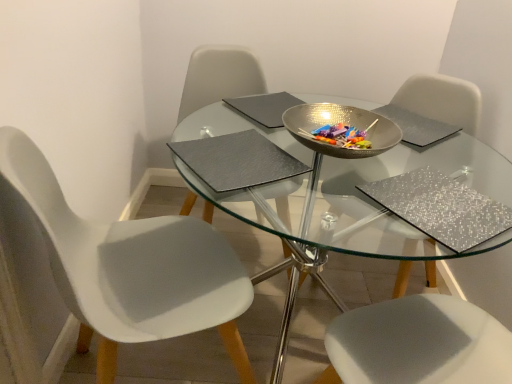
Where is `silver glittery chair at upper right, which is the first chair in right-to-left order`? The height and width of the screenshot is (384, 512). silver glittery chair at upper right, which is the first chair in right-to-left order is located at coordinates (441, 100).

Identify the location of matte gray pad at center, the 2th pad from the right. This screenshot has width=512, height=384. (265, 107).

Is silver glittery placemat at lower right, arranged as the second place mat when viewed from the left, positioned beyond the bounds of silver glittery chair at upper right, arranged as the 3th chair when viewed from the left?

silver glittery placemat at lower right, arranged as the second place mat when viewed from the left, is positioned outside silver glittery chair at upper right, arranged as the 3th chair when viewed from the left.

Considering the relative sizes of silver glittery placemat at lower right, positioned as the first place mat in right-to-left order, and silver glittery chair at upper right, which is the first chair in right-to-left order, in the image provided, is silver glittery placemat at lower right, positioned as the first place mat in right-to-left order, shorter than silver glittery chair at upper right, which is the first chair in right-to-left order,?

Yes, silver glittery placemat at lower right, positioned as the first place mat in right-to-left order, is shorter than silver glittery chair at upper right, which is the first chair in right-to-left order.

From the image's perspective, who appears lower, silver glittery placemat at lower right, positioned as the first place mat in right-to-left order, or silver glittery chair at upper right, which is the first chair in right-to-left order?

silver glittery placemat at lower right, positioned as the first place mat in right-to-left order, is shown below in the image.

From a real-world perspective, relative to silver glittery chair at upper right, arranged as the 3th chair when viewed from the left, is silver glittery placemat at lower right, positioned as the first place mat in right-to-left order, vertically above or below?

Clearly, from a real-world perspective, silver glittery placemat at lower right, positioned as the first place mat in right-to-left order, is above silver glittery chair at upper right, arranged as the 3th chair when viewed from the left.

Can you tell me how much white matte chair at left, which appears as the 1th chair when viewed from the left, and matte gray pad at center, which ranks as the 1th pad in left-to-right order, differ in facing direction?

They differ by 103 degrees in their facing directions.

Could you measure the distance between white matte chair at left, the 3th chair viewed from the right, and matte gray pad at center, which ranks as the 1th pad in left-to-right order?

They are 56.45 centimeters apart.

Does white matte chair at left, which appears as the 1th chair when viewed from the left, turn towards matte gray pad at center, the 2th pad from the right?

No, white matte chair at left, which appears as the 1th chair when viewed from the left, is not oriented towards matte gray pad at center, the 2th pad from the right.

Which of these two, white matte chair at left, which appears as the 1th chair when viewed from the left, or matte gray pad at center, the 2th pad from the right, is bigger?

white matte chair at left, which appears as the 1th chair when viewed from the left, is bigger.

Is point (388, 105) farther from viewer compared to point (453, 110)?

Yes, it is.

Is silver textured pad at upper center, which is the 2th pad in left-to-right order, facing towards silver glittery chair at upper right, which is the first chair in right-to-left order?

Yes, silver textured pad at upper center, which is the 2th pad in left-to-right order, is facing silver glittery chair at upper right, which is the first chair in right-to-left order.

Can you confirm if silver textured pad at upper center, which is the 2th pad in left-to-right order, is shorter than silver glittery chair at upper right, arranged as the 3th chair when viewed from the left?

Indeed, silver textured pad at upper center, which is the 2th pad in left-to-right order, has a lesser height compared to silver glittery chair at upper right, arranged as the 3th chair when viewed from the left.

Can you tell me how much silver textured pad at upper center, arranged as the first pad when viewed from the right, and silver glittery chair at upper right, which is the first chair in right-to-left order, differ in facing direction?

They differ by 176 degrees in their facing directions.

From the image's perspective, does silver textured pad at upper center, arranged as the first pad when viewed from the right, appear lower than matte gray place mat at center, the 1th place mat viewed from the left?

No.

Would you consider silver textured pad at upper center, which is the 2th pad in left-to-right order, to be distant from matte gray place mat at center, the 1th place mat viewed from the left?

No.

In order to click on the 2nd pad counting from the right of the matte gray place mat at center, which is counted as the 2th place mat, starting from the right in this screenshot , I will do `click(417, 126)`.

Looking at this image, which object is wider, silver textured pad at upper center, arranged as the first pad when viewed from the right, or matte gray place mat at center, which is counted as the 2th place mat, starting from the right?

matte gray place mat at center, which is counted as the 2th place mat, starting from the right.

The width and height of the screenshot is (512, 384). What are the coordinates of `chair that appears in front of the silver glittery placemat at lower right, arranged as the second place mat when viewed from the left` in the screenshot? It's located at point(132,268).

From the image's perspective, is white matte chair at left, the 3th chair viewed from the right, under silver glittery placemat at lower right, positioned as the first place mat in right-to-left order?

Yes, from the image's perspective, white matte chair at left, the 3th chair viewed from the right, is below silver glittery placemat at lower right, positioned as the first place mat in right-to-left order.

Is white matte chair at left, the 3th chair viewed from the right, situated inside silver glittery placemat at lower right, positioned as the first place mat in right-to-left order, or outside?

The correct answer is: outside.

Is white matte chair at left, which appears as the 1th chair when viewed from the left, facing away from silver glittery placemat at lower right, arranged as the second place mat when viewed from the left?

That's not correct — white matte chair at left, which appears as the 1th chair when viewed from the left, is not looking away from silver glittery placemat at lower right, arranged as the second place mat when viewed from the left.

Which of these two, matte gray place mat at center, the 1th place mat viewed from the left, or white matte chair at left, the 3th chair viewed from the right, stands taller?

Standing taller between the two is white matte chair at left, the 3th chair viewed from the right.

Between matte gray place mat at center, the 1th place mat viewed from the left, and white matte chair at left, the 3th chair viewed from the right, which one has smaller size?

matte gray place mat at center, the 1th place mat viewed from the left.

Is matte gray place mat at center, which is counted as the 2th place mat, starting from the right, next to white matte chair at left, which appears as the 1th chair when viewed from the left, and touching it?

No, matte gray place mat at center, which is counted as the 2th place mat, starting from the right, is not in contact with white matte chair at left, which appears as the 1th chair when viewed from the left.

Which object is more forward, shiny metallic bowl at center or matte gray place mat at center, which is counted as the 2th place mat, starting from the right?

matte gray place mat at center, which is counted as the 2th place mat, starting from the right, is in front.

From the image's perspective, is shiny metallic bowl at center above or below matte gray place mat at center, the 1th place mat viewed from the left?

From the image's perspective, shiny metallic bowl at center appears above matte gray place mat at center, the 1th place mat viewed from the left.

Is matte gray place mat at center, which is counted as the 2th place mat, starting from the right, at the back of shiny metallic bowl at center?

No, matte gray place mat at center, which is counted as the 2th place mat, starting from the right, is not at the back of shiny metallic bowl at center.

You are a GUI agent. You are given a task and a screenshot of the screen. Output one action in this format:
    pyautogui.click(x=<x>, y=<y>)
    Task: Click on the place mat that is the 1st object located below the shiny metallic bowl at center (from the image's perspective)
    The width and height of the screenshot is (512, 384).
    Given the screenshot: What is the action you would take?
    pyautogui.click(x=238, y=161)

The width and height of the screenshot is (512, 384). Find the location of `place mat that is below the silver glittery chair at upper right, which is the first chair in right-to-left order (from the image's perspective)`. place mat that is below the silver glittery chair at upper right, which is the first chair in right-to-left order (from the image's perspective) is located at coordinates (441, 207).

From the matte gray pad at center, which ranks as the 1th pad in left-to-right order, count the 2nd chair to the left and point to it. Please provide its 2D coordinates.

[(132, 268)]

Which object lies further to the anchor point matte gray pad at center, the 2th pad from the right, clear glass table at center or silver glittery chair at upper right, arranged as the 3th chair when viewed from the left?

silver glittery chair at upper right, arranged as the 3th chair when viewed from the left, is further to matte gray pad at center, the 2th pad from the right.

Based on their spatial positions, is matte gray pad at center, which ranks as the 1th pad in left-to-right order, or matte gray place mat at center, which is counted as the 2th place mat, starting from the right, further from silver glittery chair at upper right, which is the first chair in right-to-left order?

The object further to silver glittery chair at upper right, which is the first chair in right-to-left order, is matte gray place mat at center, which is counted as the 2th place mat, starting from the right.

Estimate the real-world distances between objects in this image. Which object is closer to clear glass table at center, matte gray place mat at center, which is counted as the 2th place mat, starting from the right, or matte gray pad at center, which ranks as the 1th pad in left-to-right order?

matte gray place mat at center, which is counted as the 2th place mat, starting from the right.

Looking at the image, which one is located closer to white matte chair at left, the 3th chair viewed from the right, matte gray pad at center, which ranks as the 1th pad in left-to-right order, or shiny metallic bowl at center?

shiny metallic bowl at center is positioned closer to the anchor white matte chair at left, the 3th chair viewed from the right.

Estimate the real-world distances between objects in this image. Which object is closer to matte gray pad at center, which ranks as the 1th pad in left-to-right order, white matte chair at left, which appears as the 1th chair when viewed from the left, or shiny metallic bowl at center?

shiny metallic bowl at center is positioned closer to the anchor matte gray pad at center, which ranks as the 1th pad in left-to-right order.

From the image, which object appears to be farther from shiny metallic bowl at center, silver glittery chair at upper right, arranged as the 3th chair when viewed from the left, or white matte chair at left, which appears as the 1th chair when viewed from the left?

white matte chair at left, which appears as the 1th chair when viewed from the left, is further to shiny metallic bowl at center.

Considering their positions, is matte gray chair at center, the second chair positioned from the left, positioned further to clear glass table at center than matte gray place mat at center, the 1th place mat viewed from the left?

Among the two, matte gray chair at center, the second chair positioned from the left, is located further to clear glass table at center.

Estimate the real-world distances between objects in this image. Which object is closer to clear glass table at center, white matte chair at left, the 3th chair viewed from the right, or silver glittery placemat at lower right, positioned as the first place mat in right-to-left order?

Based on the image, silver glittery placemat at lower right, positioned as the first place mat in right-to-left order, appears to be nearer to clear glass table at center.

The width and height of the screenshot is (512, 384). I want to click on place mat located between matte gray place mat at center, which is counted as the 2th place mat, starting from the right, and silver textured pad at upper center, arranged as the first pad when viewed from the right, in the left-right direction, so click(441, 207).

The image size is (512, 384). Find the location of `pad between matte gray place mat at center, the 1th place mat viewed from the left, and silver textured pad at upper center, arranged as the first pad when viewed from the right, from left to right`. pad between matte gray place mat at center, the 1th place mat viewed from the left, and silver textured pad at upper center, arranged as the first pad when viewed from the right, from left to right is located at coordinates (265, 107).

In order to click on chair located between clear glass table at center and silver textured pad at upper center, which is the 2th pad in left-to-right order, in the depth direction in this screenshot , I will do `click(441, 100)`.

I want to click on pad between white matte chair at left, the 3th chair viewed from the right, and silver textured pad at upper center, which is the 2th pad in left-to-right order, in the horizontal direction, so click(265, 107).